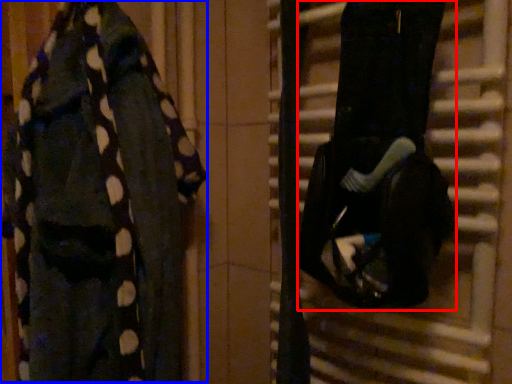
Question: Which object appears closest to the camera in this image, wide (highlighted by a red box) or underclothes (highlighted by a blue box)?

Choices:
 (A) wide
 (B) underclothes

Answer: (B)